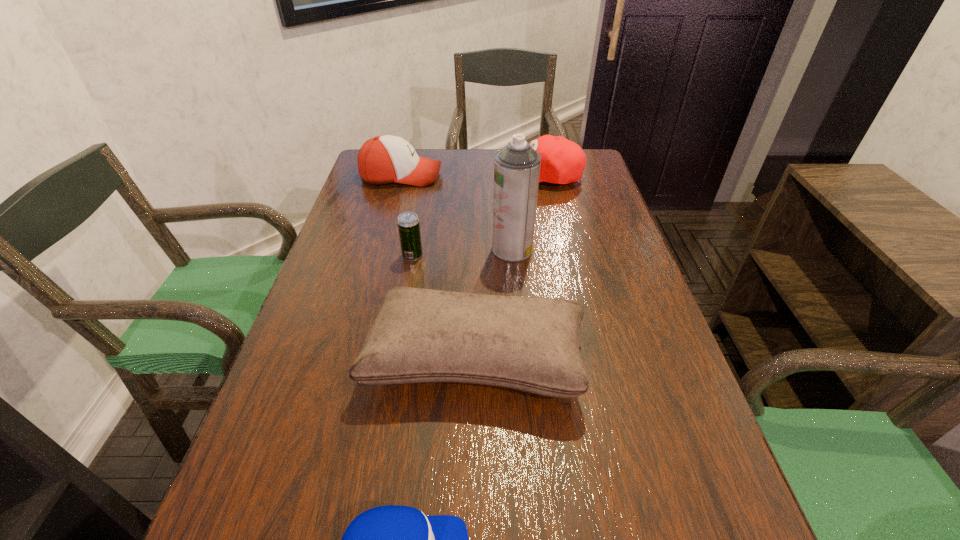
What are the coordinates of `aerosol can` in the screenshot? It's located at (517, 166).

Image resolution: width=960 pixels, height=540 pixels. What are the coordinates of `the fifth farthest object` in the screenshot? It's located at (531, 344).

Where is `the rightmost baseball cap`? the rightmost baseball cap is located at coordinates (562, 161).

Where is `beer can`? The height and width of the screenshot is (540, 960). beer can is located at coordinates (408, 222).

Image resolution: width=960 pixels, height=540 pixels. I want to click on vacant region located 0.310m on the front of the aerosol can, so click(x=522, y=366).

Locate an element on the screen. The width and height of the screenshot is (960, 540). vacant space located on the front of the cushion is located at coordinates (473, 477).

The width and height of the screenshot is (960, 540). I want to click on vacant space located 0.050m on the front panel of the rightmost baseball cap, so click(x=484, y=176).

At what (x,y) coordinates should I click in order to perform the action: click on vacant space located 0.270m on the front panel of the rightmost baseball cap. Please return your answer as a coordinate pair (x, y). The height and width of the screenshot is (540, 960). Looking at the image, I should click on (415, 176).

This screenshot has height=540, width=960. Identify the location of free space located 0.080m on the front panel of the rightmost baseball cap. (474, 176).

What are the coordinates of `free location located on the right of the beer can` in the screenshot? It's located at (446, 255).